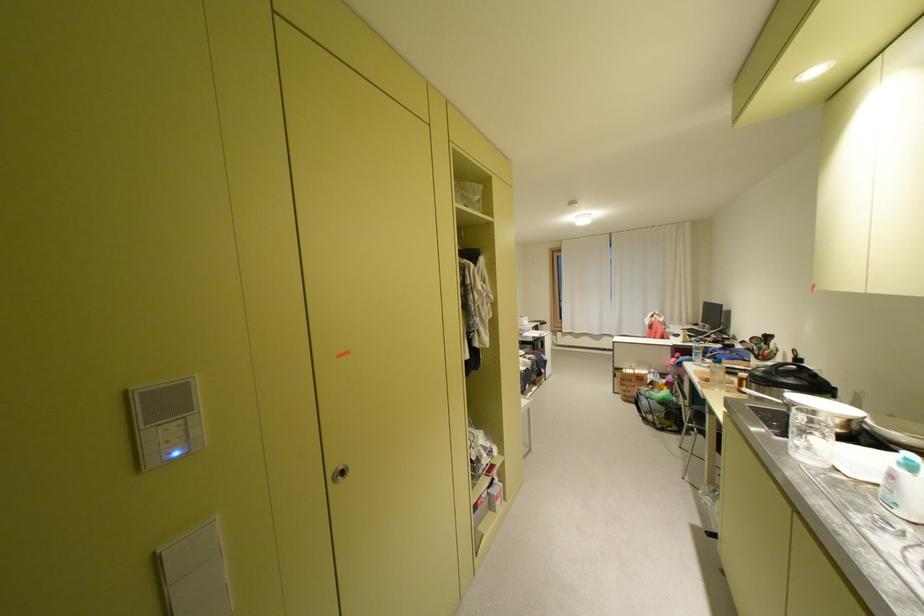
Find where to push the white light switch. Please return your answer as a coordinate pair (x, y).

(195, 573)